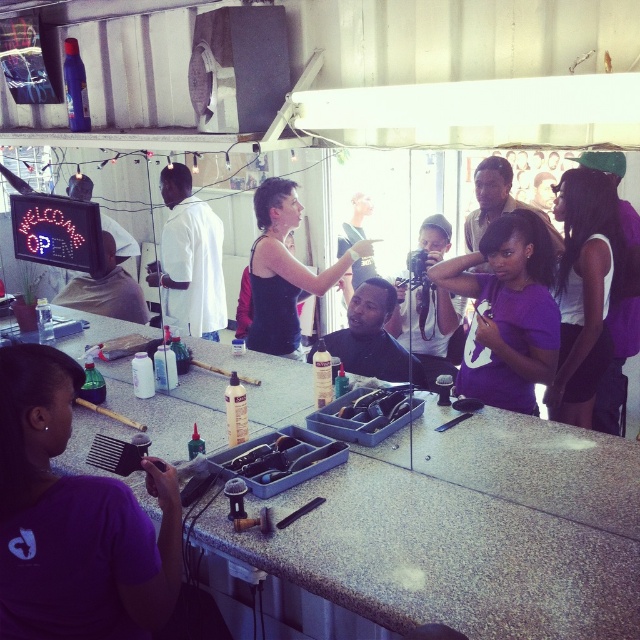
Question: Which point is farther from the camera taking this photo?

Choices:
 (A) pos(273,321)
 (B) pos(529,260)
 (C) pos(275,188)
 (D) pos(20,496)

Answer: (A)

Question: Is matte black hairbrush at center smaller than short dark hair at center?

Choices:
 (A) no
 (B) yes

Answer: (A)

Question: Considering the real-world distances, which object is closest to the white matte shirt at center?

Choices:
 (A) short curly hair at center
 (B) short dark hair at center
 (C) white matte tank top at right

Answer: (B)

Question: Does purple matte comb at lower left lie behind white matte tank top at right?

Choices:
 (A) no
 (B) yes

Answer: (A)

Question: Which of the following is the farthest from the observer?

Choices:
 (A) purple matte comb at lower left
 (B) purple matte hair at center

Answer: (B)

Question: Does purple matte comb at lower left have a smaller size compared to black matte tank top at center?

Choices:
 (A) yes
 (B) no

Answer: (A)